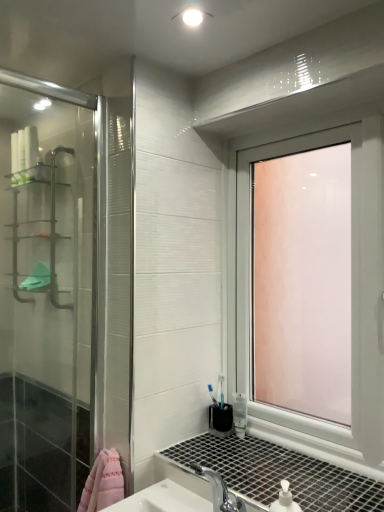
This screenshot has width=384, height=512. What are the coordinates of `free space above transparent glass window at upper right (from a real-world perspective)` in the screenshot? It's located at (284, 115).